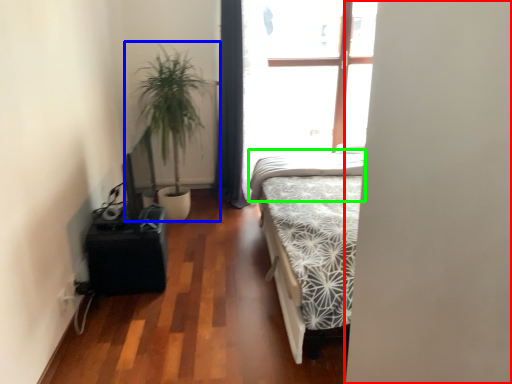
Question: Which object is positioned farthest from screen door (highlighted by a red box)? Select from houseplant (highlighted by a blue box) and mattress (highlighted by a green box).

Choices:
 (A) houseplant
 (B) mattress

Answer: (A)